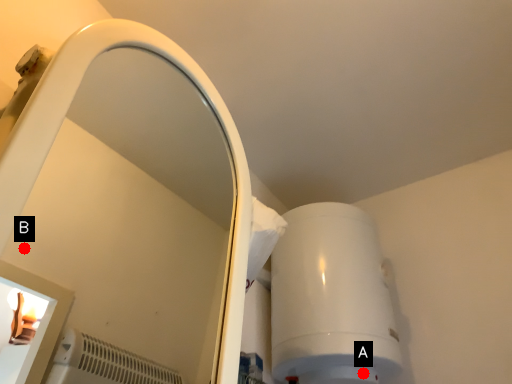
Question: Two points are circled on the image, labeled by A and B beside each circle. Which point appears farthest from the camera in this image?

Choices:
 (A) A is further
 (B) B is further

Answer: (B)